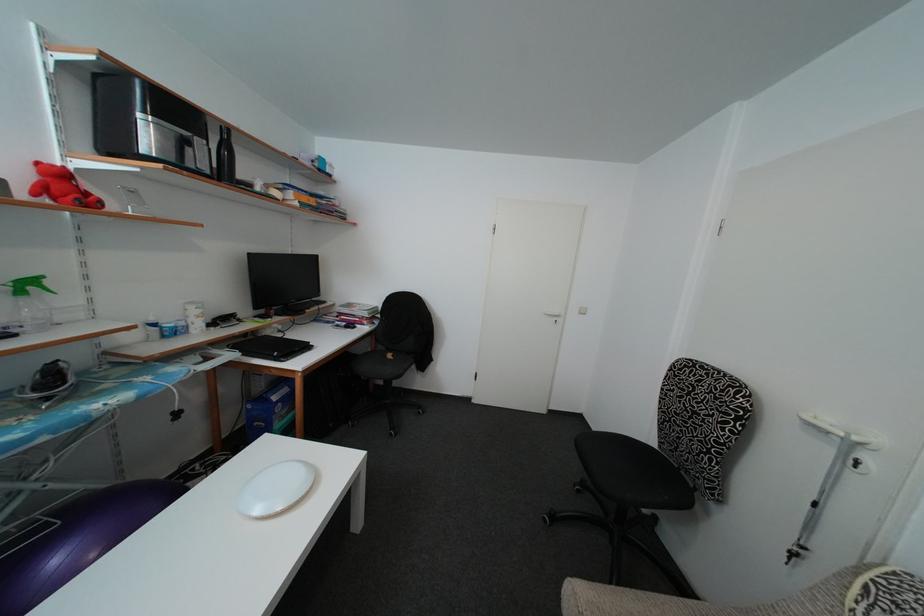
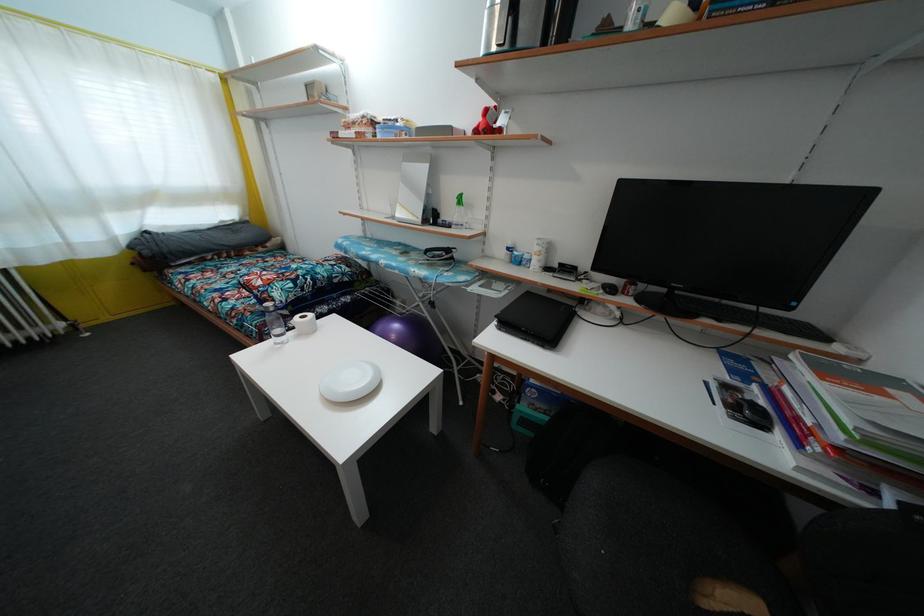
Find the pixel in the second image that matches (65,180) in the first image.

(490, 119)